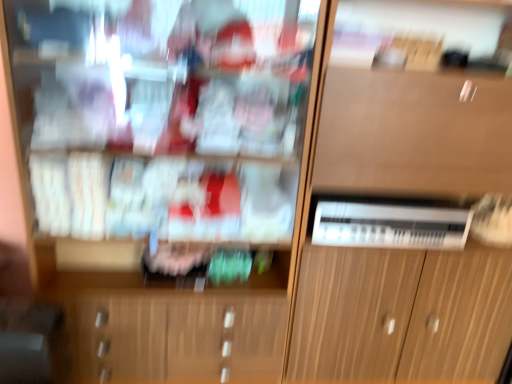
Question: Considering the positions of wooden cabinet at center and white plastic appliance at center in the image, is wooden cabinet at center wider or thinner than white plastic appliance at center?

Choices:
 (A) thin
 (B) wide

Answer: (B)

Question: Relative to white plastic appliance at center, is wooden cabinet at center in front or behind?

Choices:
 (A) front
 (B) behind

Answer: (A)

Question: Which is nearer to the wooden cabinet at center?

Choices:
 (A) white plastic appliance at center
 (B) wooden cabinet at center

Answer: (A)

Question: Based on their relative distances, which object is farther from the wooden cabinet at center?

Choices:
 (A) white plastic appliance at center
 (B) wooden cabinet at center

Answer: (A)